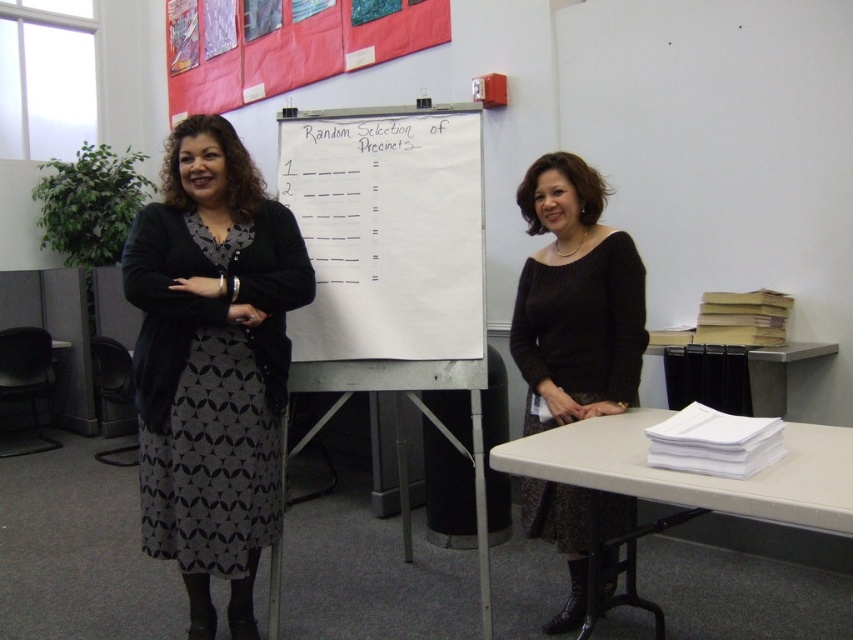
Question: Can you confirm if black knit sweater at center is thinner than white paper at right?

Choices:
 (A) yes
 (B) no

Answer: (B)

Question: Is patterned fabric skirt at left positioned before white plastic table at lower right?

Choices:
 (A) no
 (B) yes

Answer: (A)

Question: Among these objects, which one is nearest to the camera?

Choices:
 (A) white paperboard at center
 (B) patterned fabric skirt at left
 (C) black knit sweater at center
 (D) white plastic table at lower right

Answer: (D)

Question: Considering the real-world distances, which object is farthest from the black knit sweater at center?

Choices:
 (A) white paper at right
 (B) white plastic table at lower right
 (C) patterned fabric skirt at left

Answer: (C)

Question: Which is nearer to the black knit sweater at center?

Choices:
 (A) white paperboard at center
 (B) patterned fabric skirt at left
 (C) white plastic table at lower right
 (D) white paper at right

Answer: (C)

Question: Is patterned fabric skirt at left closer to camera compared to white plastic table at lower right?

Choices:
 (A) no
 (B) yes

Answer: (A)